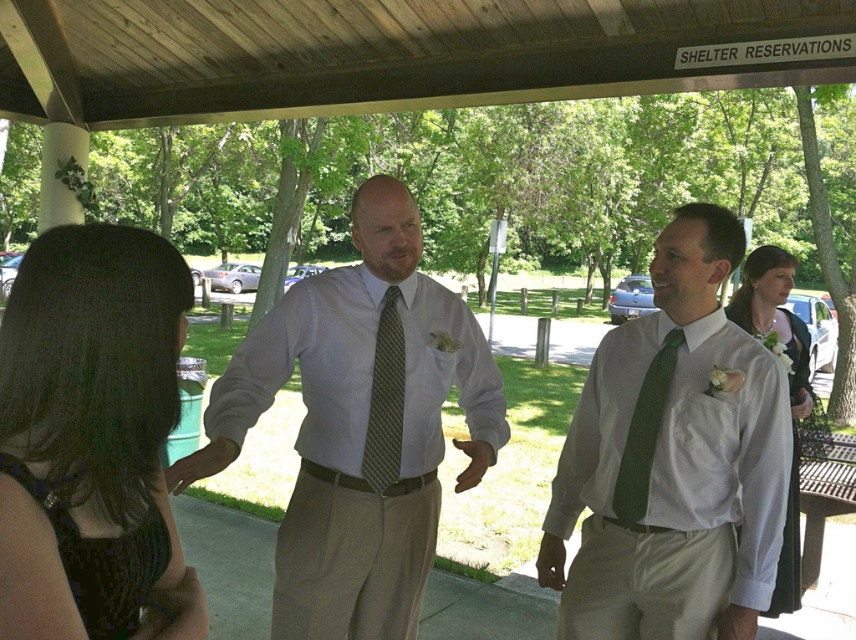
You are a photographer at the event and need to ensure both the white satin dress at center and the green textured tie at center are fully visible in the photo. Based on their positions, which object might require you to adjust your camera angle to capture its full width?

The white satin dress at center might be wider than the green textured tie at center, so adjusting the camera angle could help capture its full width.

From the picture: You are a photographer at the event and want to capture a clear photo of the white dress shirt at center and the green textured tie at center. Which one should you focus on first to ensure both are in focus?

The white dress shirt at center is in front of the green textured tie at center, so you should focus on the white dress shirt at center first to ensure both are in focus.